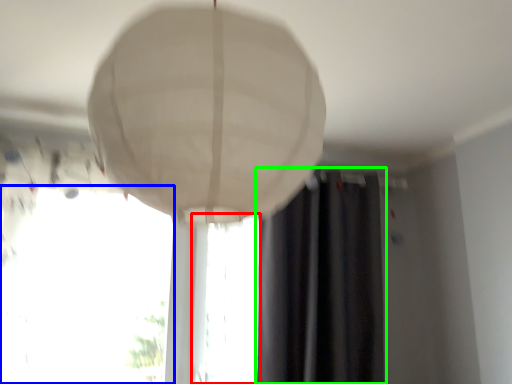
Question: Which object is positioned farthest from window (highlighted by a red box)? Select from window (highlighted by a blue box) and curtain (highlighted by a green box).

Choices:
 (A) window
 (B) curtain

Answer: (A)